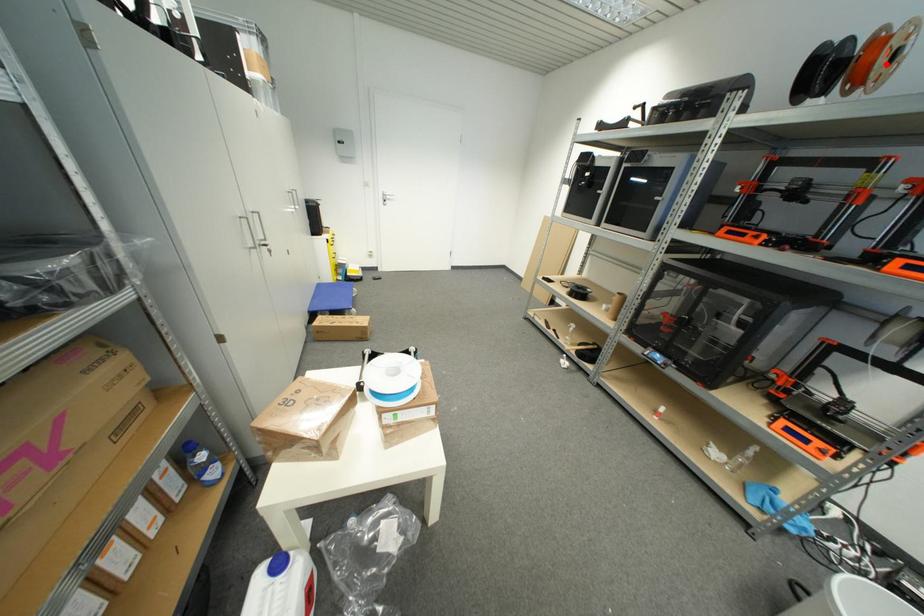
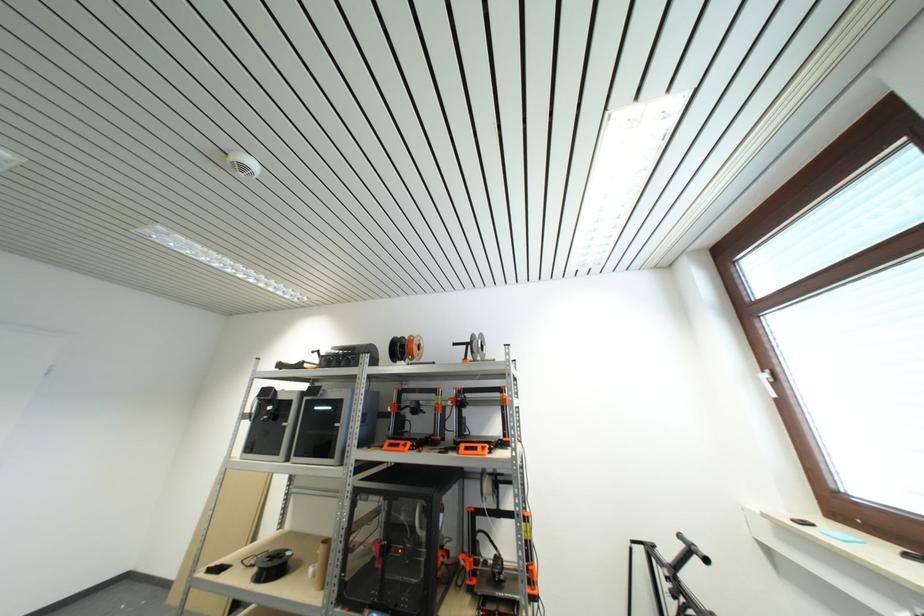
Locate, in the second image, the point that corresponds to the highlighted location in the first image.

(419, 352)